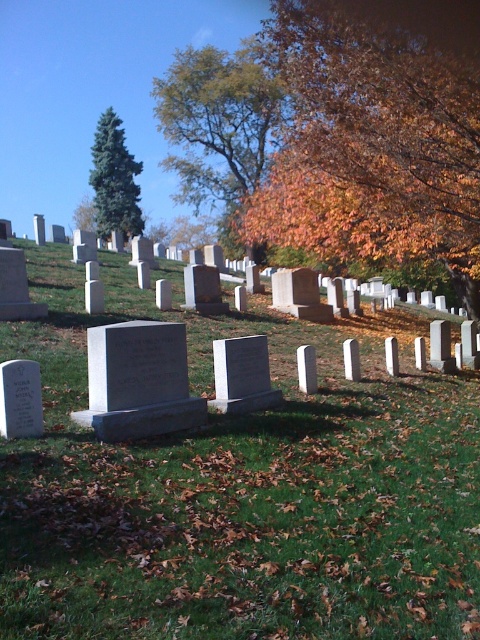
You are standing in the cemetery and notice two trees in the upper center area. Which tree is closer to the ground, the orange leafy tree at upper center or the green leafy tree at upper center?

The orange leafy tree at upper center is positioned under the green leafy tree at upper center, so the orange leafy tree at upper center is closer to the ground.

You are standing at point (239, 490) in the cemetery. What do you see directly under your feet?

You are standing on green grassy at center.

From the picture: You are standing in the cemetery and want to place a wreath exactly halfway between the two points marked as point (468, 177) and point (248, 132). Given that the cemetery path is narrow, will the wreath be placed closer to the front or the back of the two points?

The wreath placed halfway between point (468, 177) and point (248, 132) will be closer to the back of the two points because point (468, 177) is closer to the viewer than point (248, 132). Since the midpoint is calculated between their positions, the closer point reduces the overall distance towards the back point.